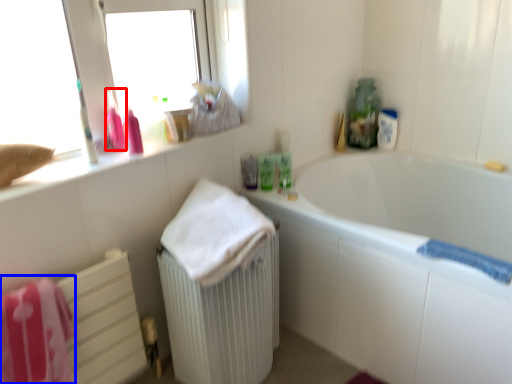
Question: Which object is further to the camera taking this photo, cleaning product (highlighted by a red box) or bath towel (highlighted by a blue box)?

Choices:
 (A) cleaning product
 (B) bath towel

Answer: (A)